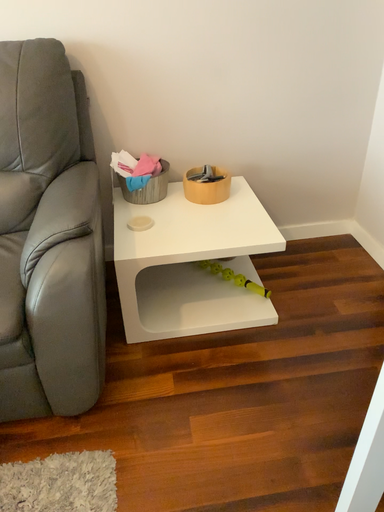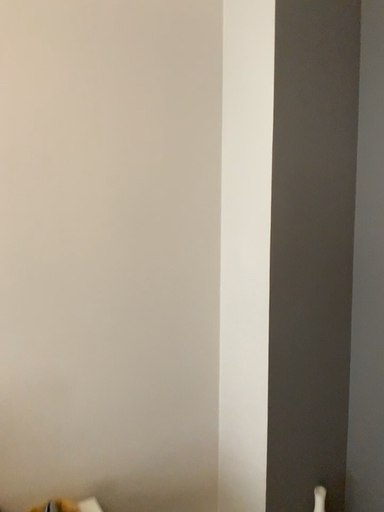
Question: How did the camera likely rotate when shooting the video?

Choices:
 (A) rotated upward
 (B) rotated downward

Answer: (A)